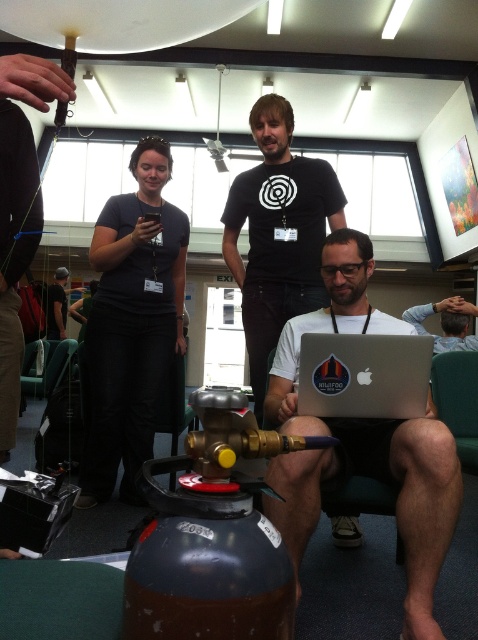
You are an attendee at a tech conference and see the white matte laptop at lower center and the dark gray fabric shirt at upper left in the scene. Which object is located to the right of the other?

The white matte laptop at lower center is positioned on the right side of dark gray fabric shirt at upper left.